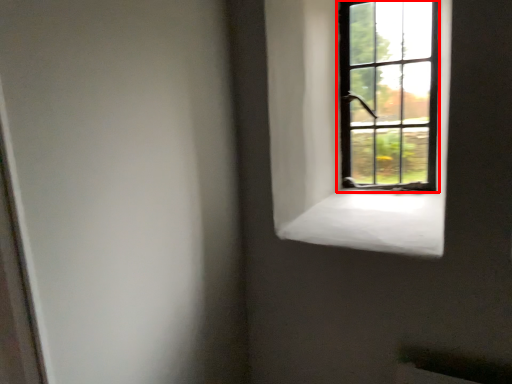
Question: From the image's perspective, considering the relative positions of window (annotated by the red box) and window sill in the image provided, where is window (annotated by the red box) located with respect to the staircase?

Choices:
 (A) above
 (B) below

Answer: (A)